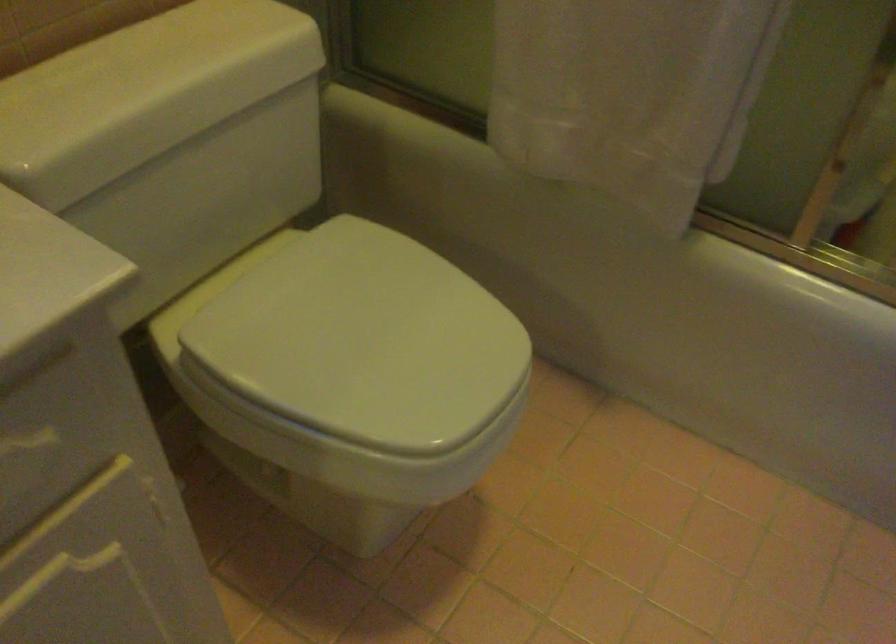
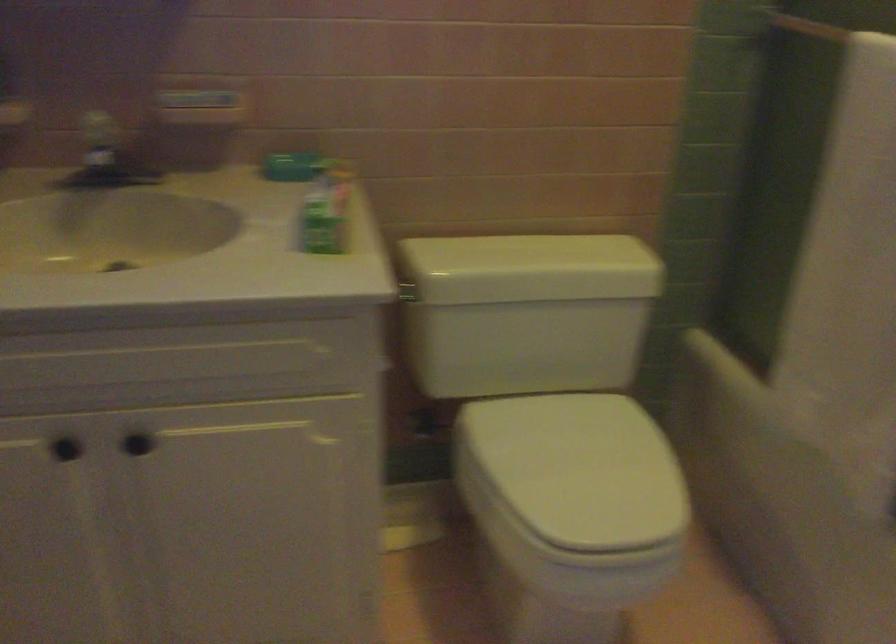
The point at [168,91] is marked in the first image. Where is the corresponding point in the second image?

(530, 268)